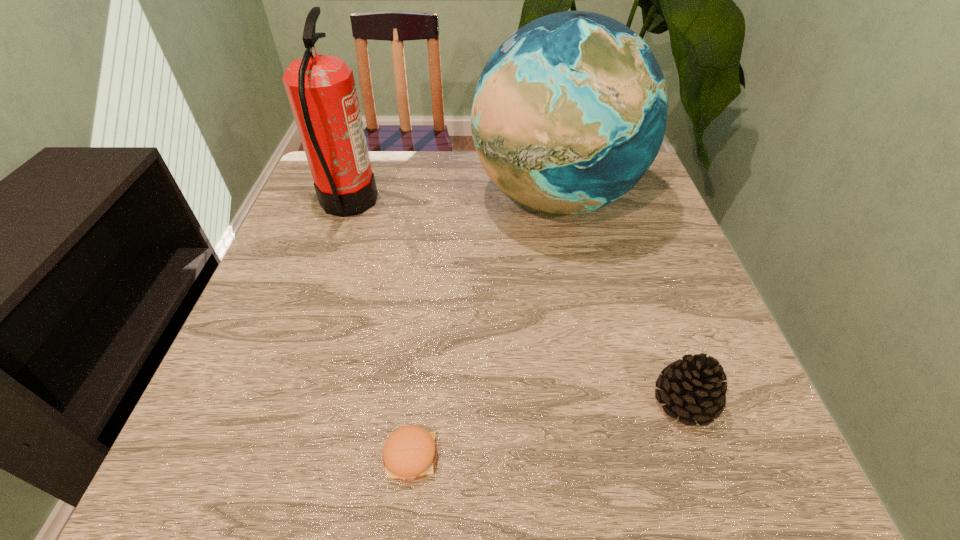
This screenshot has width=960, height=540. Find the location of `free location that satisfies the following two spatial constraints: 1. on the front side of the shortest object; 2. on the right side of the leftmost object`. free location that satisfies the following two spatial constraints: 1. on the front side of the shortest object; 2. on the right side of the leftmost object is located at coordinates (261, 456).

Where is `free space that satisfies the following two spatial constraints: 1. on the back side of the globe; 2. on the right side of the second object from left to right`? free space that satisfies the following two spatial constraints: 1. on the back side of the globe; 2. on the right side of the second object from left to right is located at coordinates (x=439, y=198).